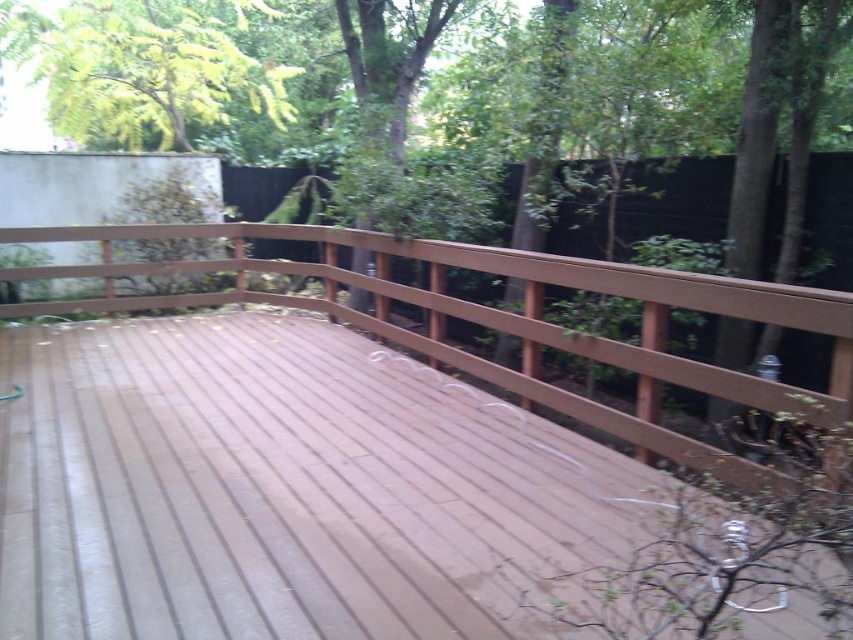
You are standing on the ground near the satin wood deck at center. You want to place a 2.0 meter long wooden bench on the deck. Can the bench fit on the deck if it is placed along the length of the deck?

The satin wood deck at center and viewer are 1.96 meters apart from each other. Since the bench is 2.0 meters long, it would be slightly too long to fit on the deck if placed along its length, as the deck is only 1.96 meters in that direction.